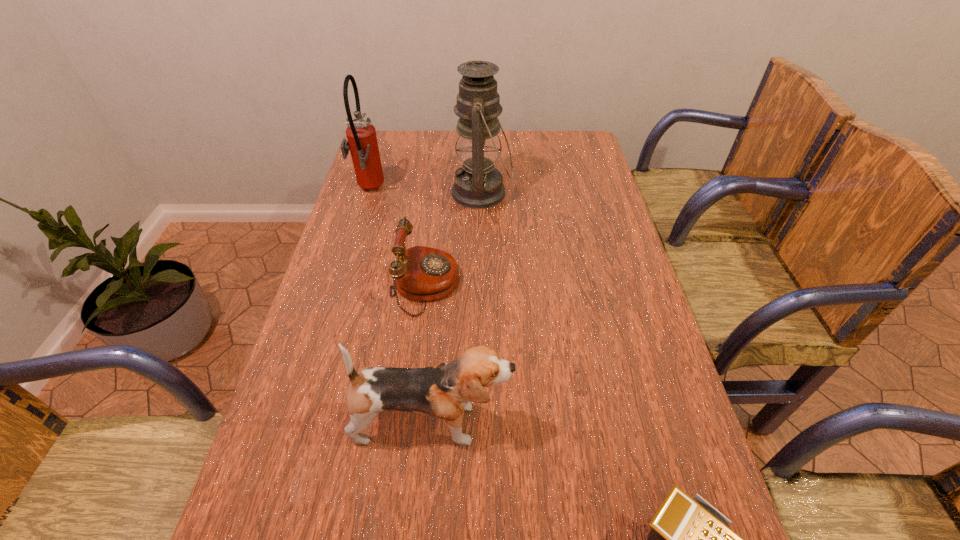
Identify the location of oil lamp. (477, 184).

Identify the location of the leftmost object. (361, 134).

Where is `the third shortest object`? This screenshot has width=960, height=540. the third shortest object is located at coordinates (443, 391).

The image size is (960, 540). I want to click on the second nearest object, so click(x=443, y=391).

The width and height of the screenshot is (960, 540). What are the coordinates of `the third nearest object` in the screenshot? It's located at (420, 273).

Where is `the fourth tallest object`? The height and width of the screenshot is (540, 960). the fourth tallest object is located at coordinates (420, 273).

Image resolution: width=960 pixels, height=540 pixels. I want to click on blank area located on the left of the oil lamp, so pos(385,193).

At what (x,y) coordinates should I click in order to perform the action: click on vacant area located at the nozzle of the fire extinguisher. Please return your answer as a coordinate pair (x, y). The image size is (960, 540). Looking at the image, I should click on (505, 190).

Find the location of a particular element. This screenshot has width=960, height=540. vacant space located 0.260m at the face of the second nearest object is located at coordinates (637, 424).

Image resolution: width=960 pixels, height=540 pixels. I want to click on vacant region located 0.380m on the dial of the second shortest object, so click(604, 286).